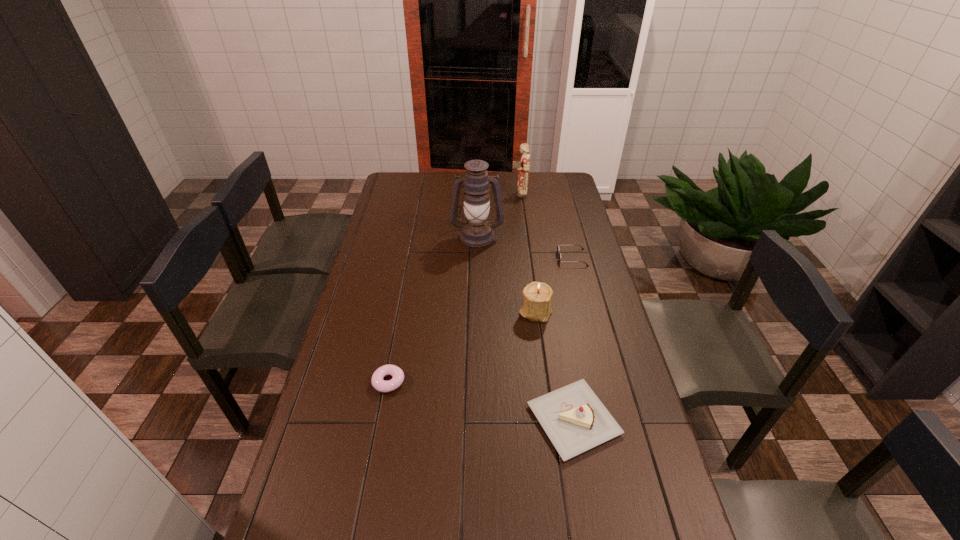
The width and height of the screenshot is (960, 540). I want to click on free location located on the front-facing side of the second tallest object, so click(460, 193).

At what (x,y) coordinates should I click in order to perform the action: click on free region located 0.210m on the front-facing side of the second tallest object. Please return your answer as a coordinate pair (x, y). The height and width of the screenshot is (540, 960). Looking at the image, I should click on (468, 193).

The height and width of the screenshot is (540, 960). What are the coordinates of `blank space located on the front-facing side of the second tallest object` in the screenshot? It's located at (456, 193).

The height and width of the screenshot is (540, 960). Find the location of `blank space located on the back of the third nearest object`. blank space located on the back of the third nearest object is located at coordinates (527, 245).

Identify the location of blank area located on the left of the cake. (453, 420).

Locate an element on the screen. The width and height of the screenshot is (960, 540). vacant region located 0.120m on the front-facing side of the sunglasses is located at coordinates (528, 258).

Where is `free spot located 0.390m on the front-facing side of the sunglasses`? This screenshot has width=960, height=540. free spot located 0.390m on the front-facing side of the sunglasses is located at coordinates (462, 258).

Find the location of a particular element. free location located on the front-facing side of the sunglasses is located at coordinates (467, 258).

Locate an element on the screen. The image size is (960, 540). free space located on the front of the doughnut is located at coordinates (366, 506).

Identify the location of object positioned at the far edge. (524, 166).